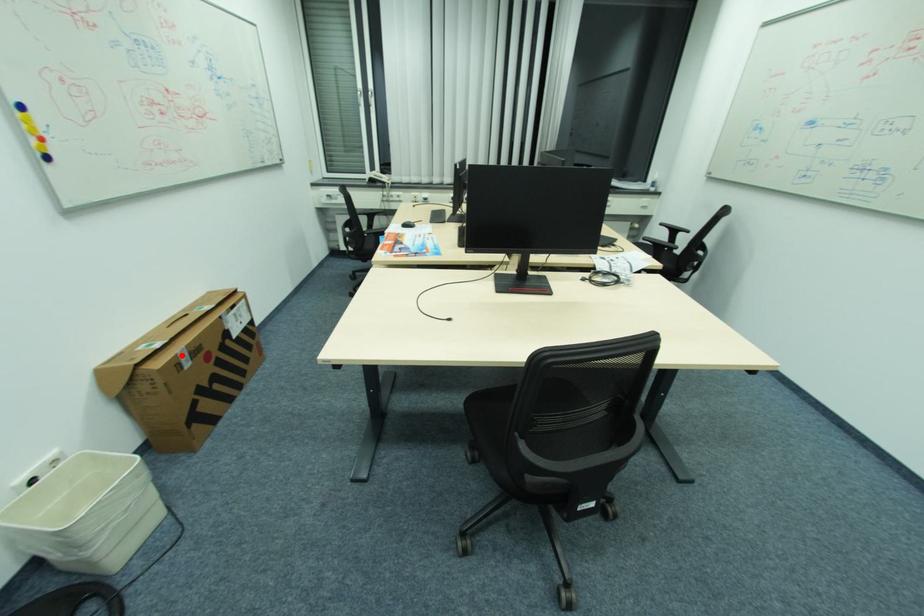
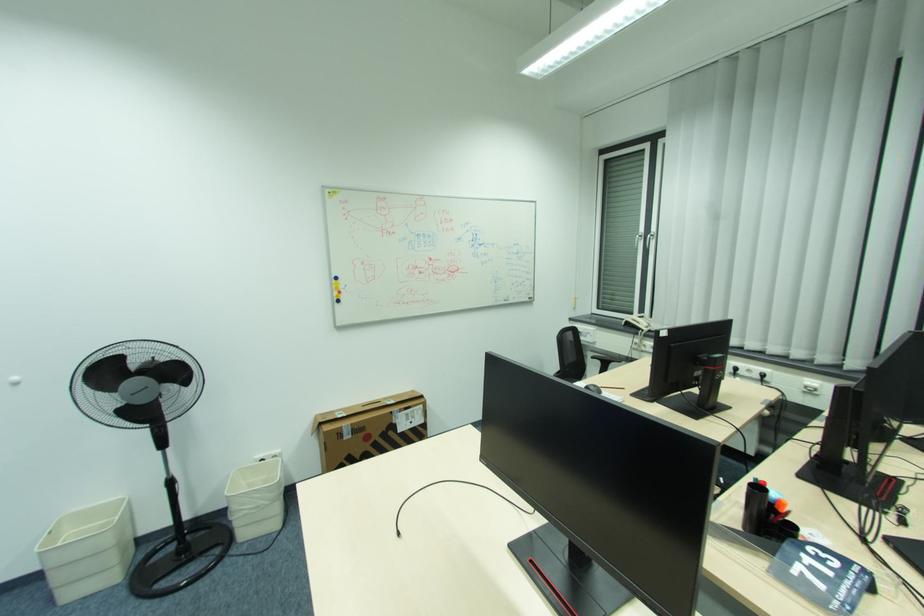
Question: I am providing you with two images of the same scene from different viewpoints. Given a red point in image1, look at the same physical point in image2. Is it:

Choices:
 (A) Closer to the viewpoint
 (B) Farther from the viewpoint

Answer: (B)